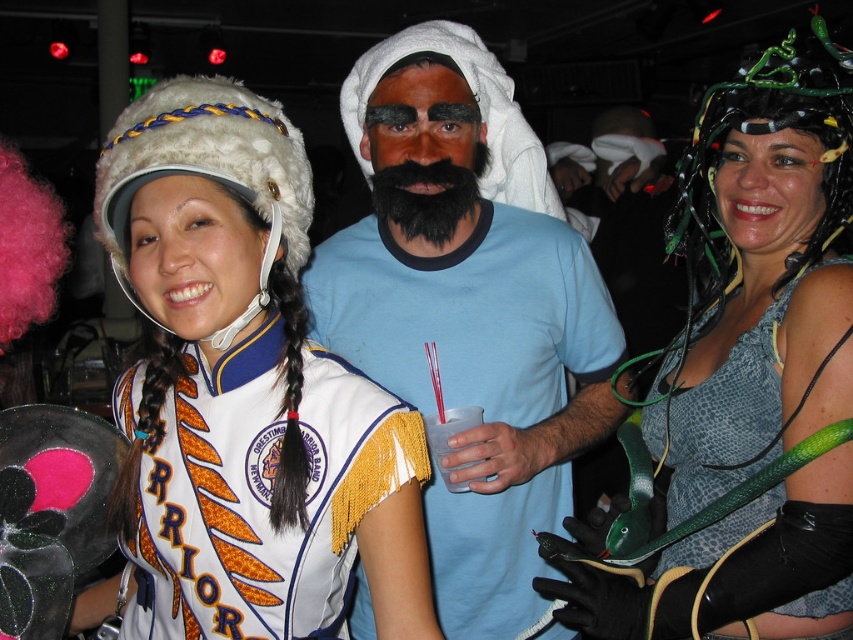
Who is higher up, white fur hat at left or leather snakeskin dress at center?

white fur hat at left is above.

Is white fur hat at left further to the viewer compared to leather snakeskin dress at center?

No, white fur hat at left is in front of leather snakeskin dress at center.

Who is more distant from viewer, [260,154] or [819,125]?

The point [819,125] is more distant.

At what (x,y) coordinates should I click in order to perform the action: click on white fur hat at left. Please return your answer as a coordinate pair (x, y). The image size is (853, 640). Looking at the image, I should click on (244, 390).

The height and width of the screenshot is (640, 853). Find the location of `blue cotton shirt at center`. blue cotton shirt at center is located at coordinates (473, 316).

Between blue cotton shirt at center and clear plastic cup at center, which one appears on the left side from the viewer's perspective?

From the viewer's perspective, clear plastic cup at center appears more on the left side.

Which is behind, point (422, 272) or point (434, 436)?

The point (422, 272) is behind.

Where is `blue cotton shirt at center`? This screenshot has width=853, height=640. blue cotton shirt at center is located at coordinates (473, 316).

Looking at this image, is green snake at right wider than black fuzzy beard at center?

Correct, the width of green snake at right exceeds that of black fuzzy beard at center.

Measure the distance from green snake at right to black fuzzy beard at center.

green snake at right is 50.77 centimeters from black fuzzy beard at center.

Identify the location of green snake at right. (728, 416).